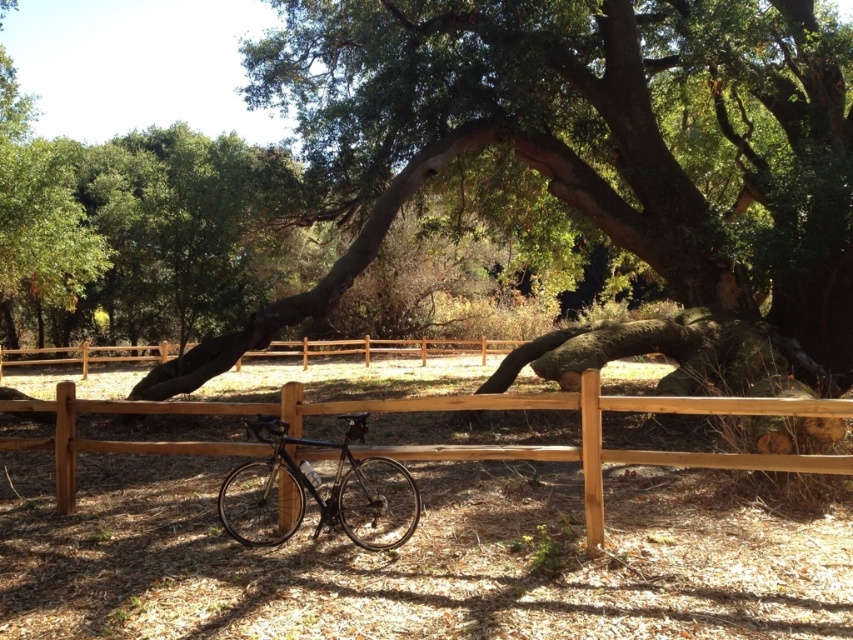
Which is in front, point (811, 365) or point (824, 467)?

Point (824, 467) is more forward.

Which is more to the left, green leafy tree at center or brown wooden fence at center?

brown wooden fence at center

Where is `green leafy tree at center`? green leafy tree at center is located at coordinates (579, 163).

Which of these two, green leafy tree at center or shiny black bicycle at center, stands taller?

green leafy tree at center is taller.

Is green leafy tree at center below shiny black bicycle at center?

No, green leafy tree at center is not below shiny black bicycle at center.

Does point (840, 248) come farther from viewer compared to point (276, 444)?

Yes.

In order to click on green leafy tree at center in this screenshot , I will do `click(579, 163)`.

Is brown wooden fence at center closer to the viewer compared to shiny black bicycle at center?

No, brown wooden fence at center is behind shiny black bicycle at center.

Does brown wooden fence at center have a lesser width compared to shiny black bicycle at center?

Indeed, brown wooden fence at center has a lesser width compared to shiny black bicycle at center.

The image size is (853, 640). Identify the location of brown wooden fence at center. (440, 444).

Where is `brown wooden fence at center`? The height and width of the screenshot is (640, 853). brown wooden fence at center is located at coordinates (440, 444).